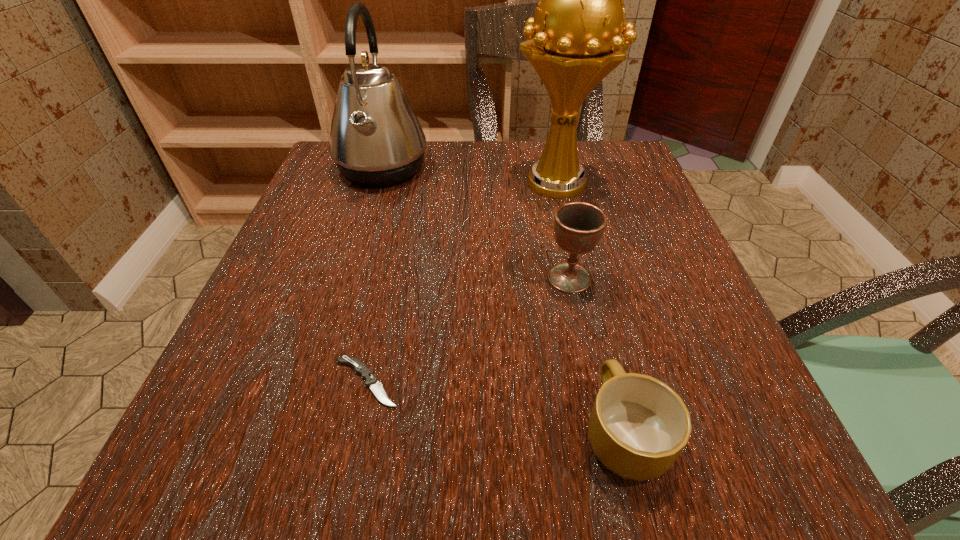
What are the coordinates of `vacant area situated on the side with the handle of the mug` in the screenshot? It's located at (602, 343).

Locate an element on the screen. This screenshot has width=960, height=540. vacant area situated 0.140m on the side with the handle of the mug is located at coordinates (593, 309).

Find the location of a particular element. vacant space located on the left of the shortest object is located at coordinates (260, 382).

The image size is (960, 540). Identify the location of trophy_cup situated at the far edge. (573, 42).

Locate an element on the screen. The height and width of the screenshot is (540, 960). kettle that is at the far edge is located at coordinates coord(376,139).

Where is `object that is at the near edge`? The height and width of the screenshot is (540, 960). object that is at the near edge is located at coordinates [638, 426].

Locate an element on the screen. object located at the left edge is located at coordinates (376, 139).

Identify the location of trophy_cup that is at the right edge. Image resolution: width=960 pixels, height=540 pixels. (573, 42).

Image resolution: width=960 pixels, height=540 pixels. Find the location of `mug located in the right edge section of the desktop`. mug located in the right edge section of the desktop is located at coordinates (638, 426).

This screenshot has height=540, width=960. In order to click on object that is at the far left corner in this screenshot , I will do `click(376, 139)`.